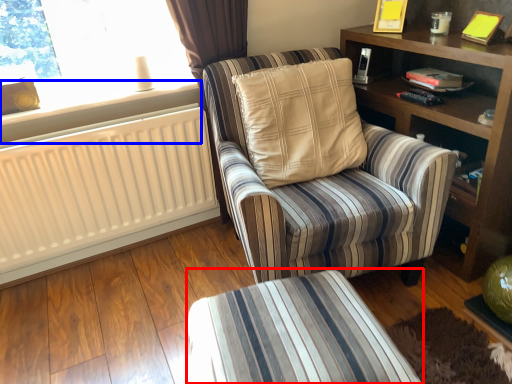
Question: Which of the following is the farthest to the observer, table (highlighted by a red box) or window sill (highlighted by a blue box)?

Choices:
 (A) table
 (B) window sill

Answer: (B)